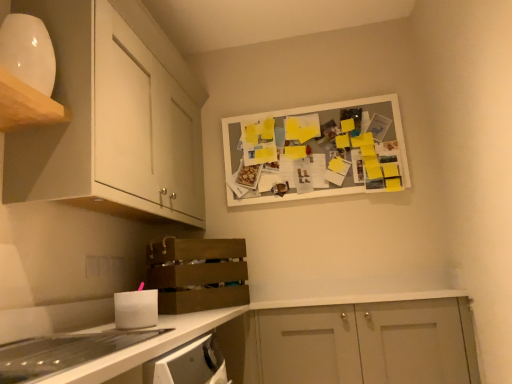
Question: Would you say white matte cabinet at upper left, the second cabinetry in the left-to-right sequence, contains white matte cabinet doors at lower right, placed as the third cabinetry when sorted from top to bottom?

Choices:
 (A) yes
 (B) no

Answer: (B)

Question: Could you tell me if white matte cabinet at upper left, positioned as the 2th cabinetry in right-to-left order, is facing white matte cabinet doors at lower right, arranged as the 1th cabinetry when ordered from the bottom?

Choices:
 (A) no
 (B) yes

Answer: (A)

Question: Does white matte cabinet at upper left, positioned as the 2th cabinetry in right-to-left order, come in front of white matte cabinet doors at lower right, placed as the first cabinetry when sorted from right to left?

Choices:
 (A) no
 (B) yes

Answer: (B)

Question: Is white matte cabinet at upper left, which ranks as the second cabinetry in bottom-to-top order, smaller than white matte cabinet doors at lower right, arranged as the 1th cabinetry when ordered from the bottom?

Choices:
 (A) no
 (B) yes

Answer: (A)

Question: Is white matte cabinet at upper left, which appears as the 2th cabinetry when viewed from the top, facing away from white matte cabinet doors at lower right, arranged as the 1th cabinetry when ordered from the bottom?

Choices:
 (A) no
 (B) yes

Answer: (A)

Question: Does white matte cabinet at upper left, which ranks as the second cabinetry in bottom-to-top order, have a greater height compared to white matte cabinet doors at lower right, the third cabinetry from the left?

Choices:
 (A) no
 (B) yes

Answer: (B)

Question: Is white matte cabinet at upper left, positioned as the 2th cabinetry in right-to-left order, bigger than white glossy cabinet at upper left, marked as the third cabinetry in a bottom-to-top arrangement?

Choices:
 (A) no
 (B) yes

Answer: (B)

Question: Can you confirm if white matte cabinet at upper left, positioned as the 2th cabinetry in right-to-left order, is wider than white glossy cabinet at upper left, marked as the third cabinetry in a bottom-to-top arrangement?

Choices:
 (A) no
 (B) yes

Answer: (B)

Question: Is white matte cabinet at upper left, which appears as the 2th cabinetry when viewed from the top, positioned behind white glossy cabinet at upper left, positioned as the first cabinetry in top-to-bottom order?

Choices:
 (A) no
 (B) yes

Answer: (A)

Question: Is white matte cabinet at upper left, the second cabinetry in the left-to-right sequence, turned away from white glossy cabinet at upper left, marked as the 3th cabinetry in a right-to-left arrangement?

Choices:
 (A) no
 (B) yes

Answer: (A)

Question: Would you say white matte cabinet at upper left, positioned as the 2th cabinetry in right-to-left order, contains white glossy cabinet at upper left, positioned as the first cabinetry in top-to-bottom order?

Choices:
 (A) no
 (B) yes

Answer: (B)

Question: From a real-world perspective, is white matte cabinet at upper left, the second cabinetry in the left-to-right sequence, positioned under white glossy cabinet at upper left, positioned as the first cabinetry in top-to-bottom order, based on gravity?

Choices:
 (A) no
 (B) yes

Answer: (B)

Question: Can you confirm if white matte cabinet doors at lower right, the third cabinetry from the left, is taller than brown wooden crate at lower left?

Choices:
 (A) no
 (B) yes

Answer: (B)